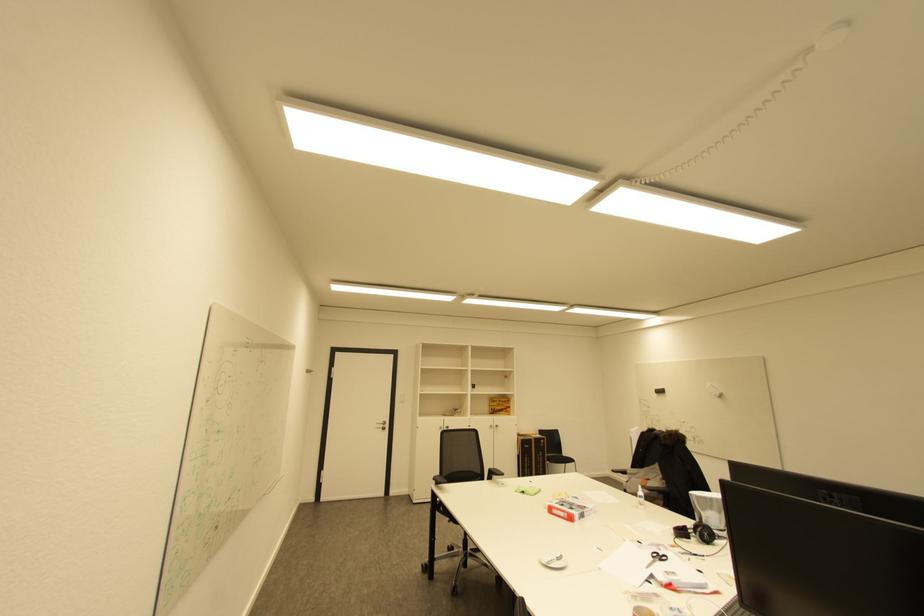
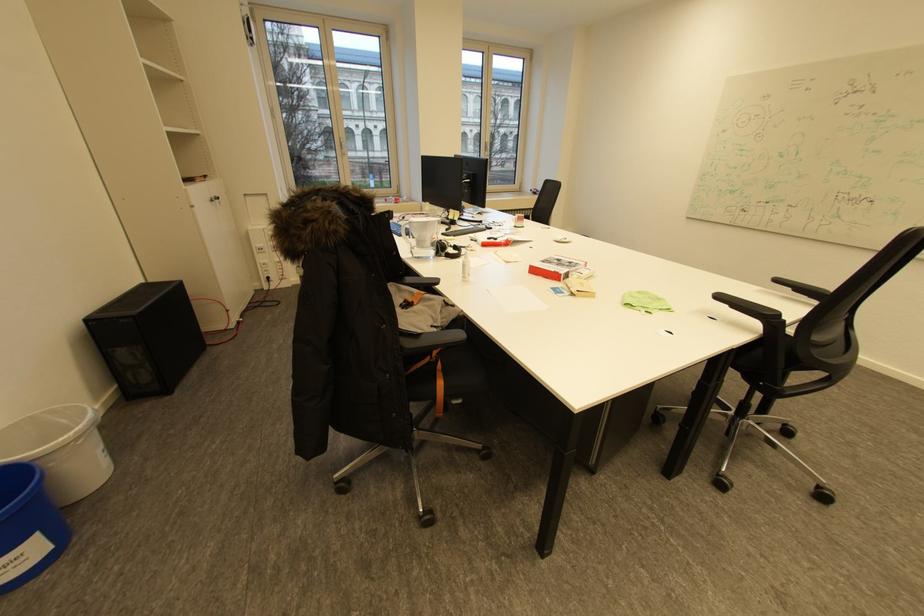
Find the pixel in the second image that matches [568,506] in the first image.

(576, 262)